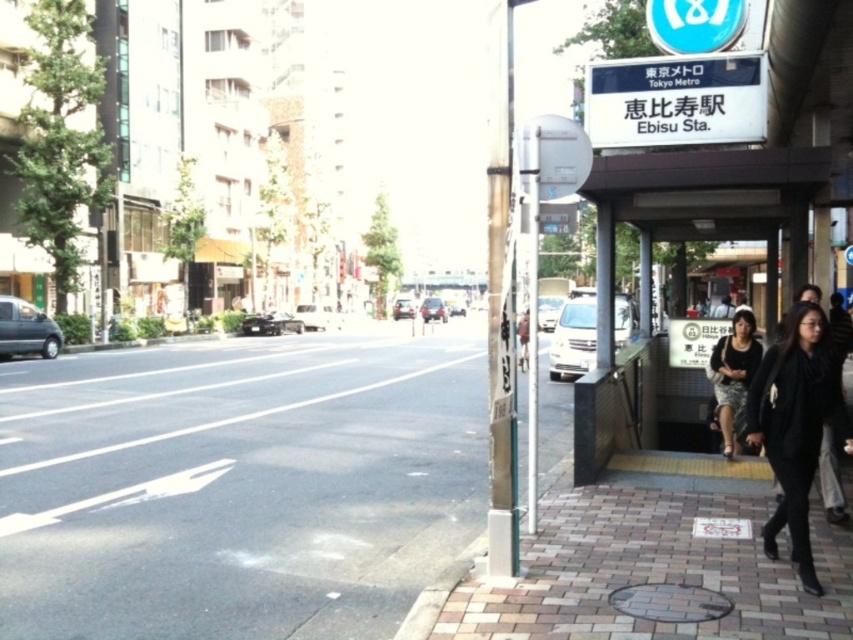
Who is more forward, (x=256, y=380) or (x=733, y=368)?

Point (x=733, y=368)

Can you confirm if gray concrete pavement at lower left is thinner than black textured skirt at lower right?

Incorrect, gray concrete pavement at lower left's width is not less than black textured skirt at lower right's.

Who is more distant from viewer, (231, 342) or (746, 356)?

Positioned behind is point (231, 342).

The height and width of the screenshot is (640, 853). What are the coordinates of `gray concrete pavement at lower left` in the screenshot? It's located at (241, 486).

Does gray concrete pavement at lower left appear on the right side of black wool coat at lower right?

Incorrect, gray concrete pavement at lower left is not on the right side of black wool coat at lower right.

Which is more to the right, gray concrete pavement at lower left or black wool coat at lower right?

black wool coat at lower right

Is point (55, 467) positioned before point (781, 419)?

No, (55, 467) is further to viewer.

The width and height of the screenshot is (853, 640). I want to click on gray concrete pavement at lower left, so click(x=241, y=486).

Can you confirm if black wool coat at lower right is positioned to the right of black textured skirt at lower right?

No, black wool coat at lower right is not to the right of black textured skirt at lower right.

Who is taller, black wool coat at lower right or black textured skirt at lower right?

black wool coat at lower right

Identify the location of black wool coat at lower right. (795, 424).